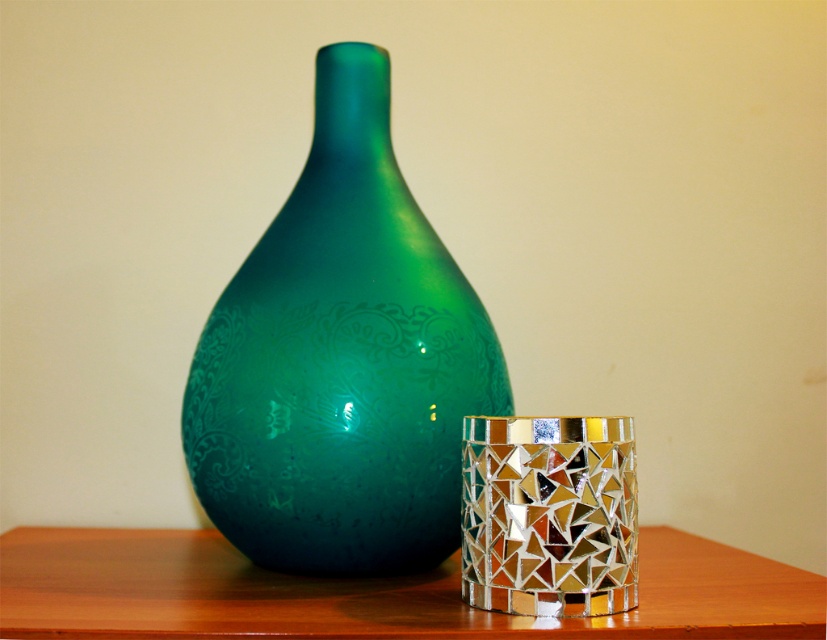
Can you confirm if wooden table at center is thinner than mirrored mosaic candle holder at right?

In fact, wooden table at center might be wider than mirrored mosaic candle holder at right.

Is wooden table at center taller than mirrored mosaic candle holder at right?

No, wooden table at center is not taller than mirrored mosaic candle holder at right.

Who is more forward, [751,598] or [547,464]?

Point [547,464] is in front.

Locate an element on the screen. This screenshot has height=640, width=827. wooden table at center is located at coordinates (367, 593).

Which of these two, green glossy vase at center or wooden table at center, stands taller?

With more height is green glossy vase at center.

Who is lower down, green glossy vase at center or wooden table at center?

Positioned lower is wooden table at center.

Who is more forward, [433,456] or [283,595]?

Point [283,595] is in front.

The height and width of the screenshot is (640, 827). I want to click on green glossy vase at center, so click(342, 360).

Is green glossy vase at center smaller than mirrored mosaic candle holder at right?

Actually, green glossy vase at center might be larger than mirrored mosaic candle holder at right.

Who is positioned more to the left, green glossy vase at center or mirrored mosaic candle holder at right?

green glossy vase at center

The image size is (827, 640). I want to click on green glossy vase at center, so click(342, 360).